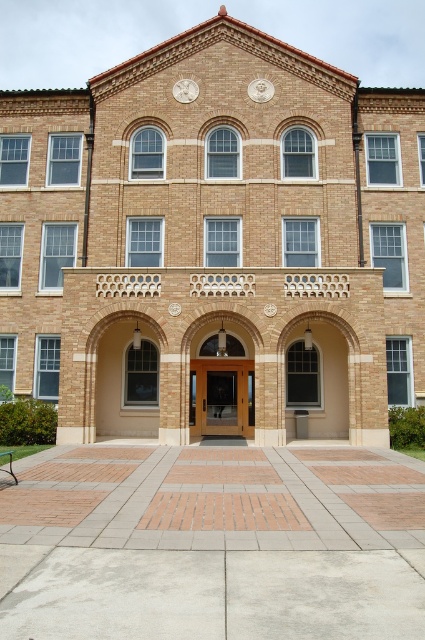
You are a delivery person trying to deliver a package to the building. The package requires a door wider than the white marble clock at upper center to pass through. Can you use the wooden door at center for delivery?

The wooden door at center might be wider than the white marble clock at upper center, so it is possible that the wooden door at center can accommodate the package. However, since the comparison is uncertain, you should measure the door width before attempting delivery.

You are standing in front of the building and notice the wooden door at center and the white marble clock at upper center. Which object is positioned to the left when viewed from your perspective?

The white marble clock at upper center is positioned to the left of the wooden door at center.

From the picture: You are a maintenance worker needing to reach both the wooden door at center and the white marble clock at upper center for repairs. The ladder you have can extend up to 10 meters. Based on the scene, can you safely reach both objects with your ladder without needing to move it?

The wooden door at center and white marble clock at upper center are 11.62 meters apart from each other. Since the ladder can only extend up to 10 meters, it is not long enough to reach both objects without moving it.